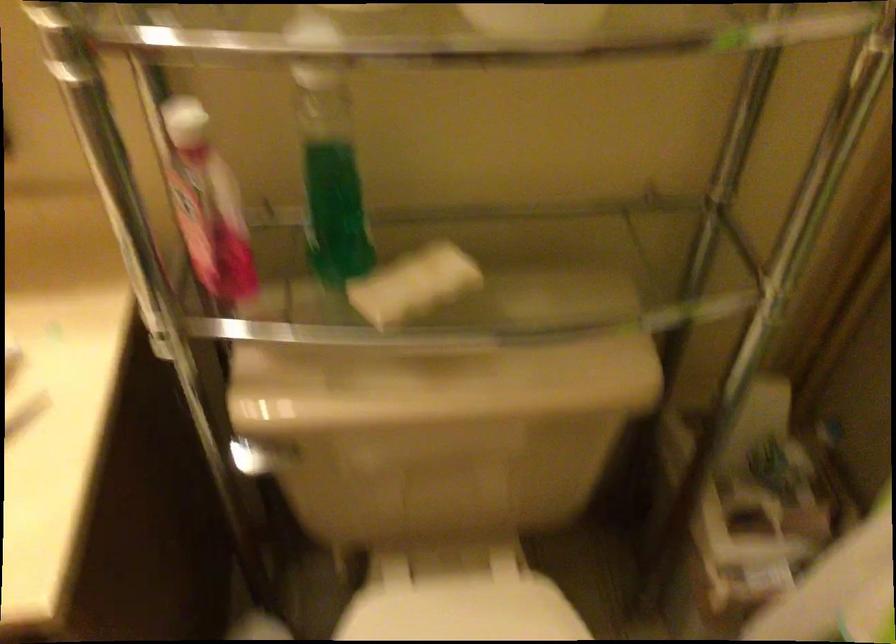
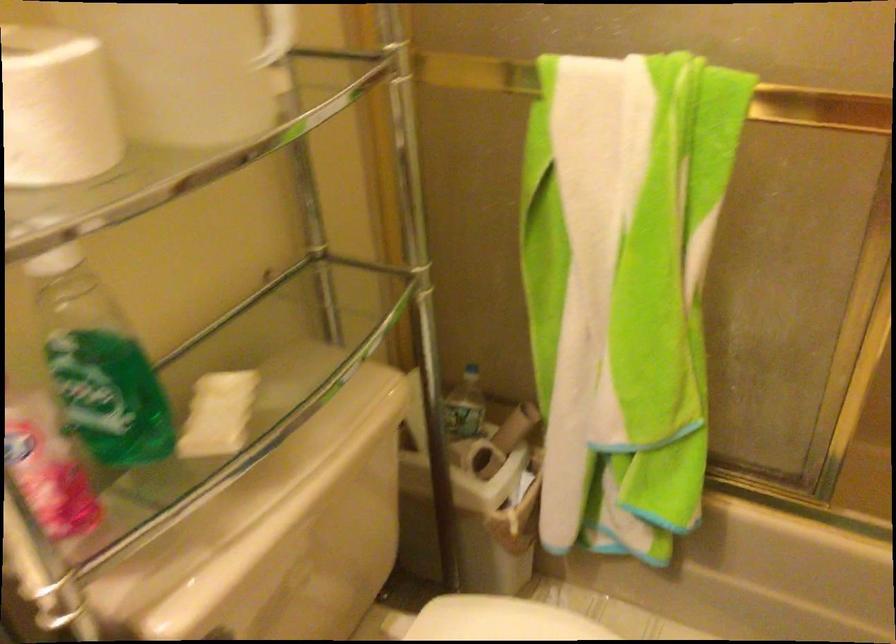
Question: The first image is from the beginning of the video and the second image is from the end. How did the camera likely rotate when shooting the video?

Choices:
 (A) Left
 (B) Right
 (C) Up
 (D) Down

Answer: (B)